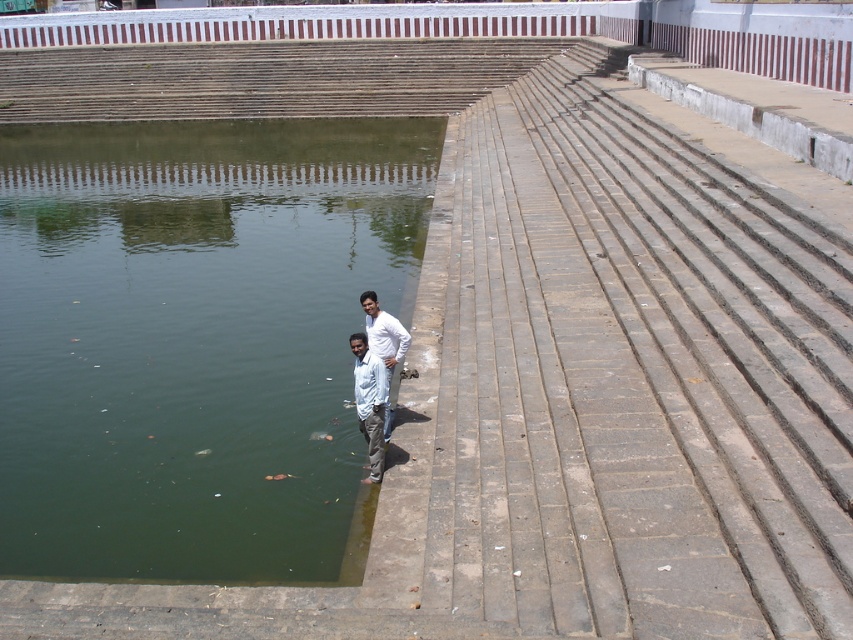
Question: Is green concrete lake at lower left bigger than white cotton shirt at lower center?

Choices:
 (A) yes
 (B) no

Answer: (A)

Question: Is green concrete lake at lower left bigger than white cotton shirt at lower center?

Choices:
 (A) yes
 (B) no

Answer: (A)

Question: Does white cotton shirt at lower center have a smaller size compared to white matte shirt at lower center?

Choices:
 (A) yes
 (B) no

Answer: (A)

Question: Which object appears closest to the camera in this image?

Choices:
 (A) white cotton shirt at lower center
 (B) white matte shirt at lower center
 (C) green concrete lake at lower left

Answer: (C)

Question: Estimate the real-world distances between objects in this image. Which object is closer to the white matte shirt at lower center?

Choices:
 (A) green concrete lake at lower left
 (B) white cotton shirt at lower center

Answer: (B)

Question: Estimate the real-world distances between objects in this image. Which object is closer to the green concrete lake at lower left?

Choices:
 (A) white cotton shirt at lower center
 (B) white matte shirt at lower center

Answer: (A)